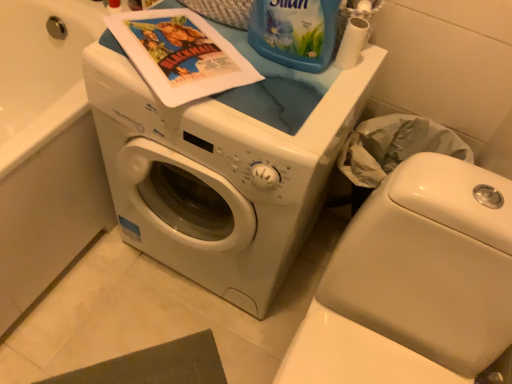
Where is `free space above white glossy washing machine at center (from a real-world perspective)`? This screenshot has width=512, height=384. free space above white glossy washing machine at center (from a real-world perspective) is located at coordinates (225, 60).